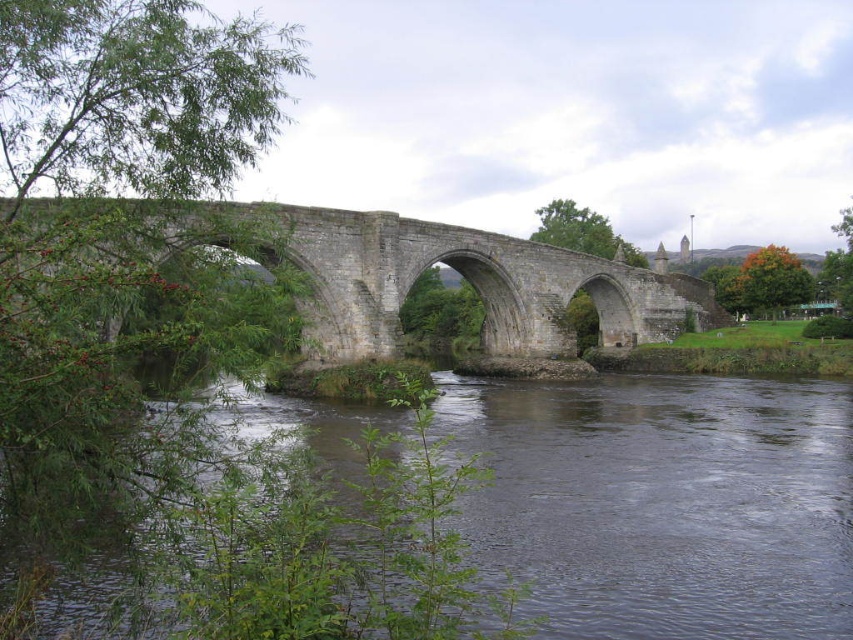
Consider the image. You are standing at the stone bridge and want to throw a pebble into the dark gray water at center. Considering the distance, will the pebble reach the water if you throw it with a maximum range of 150 feet?

The dark gray water at center is 175.76 feet away from the viewer. Since your maximum throw range is 150 feet, the pebble will not reach the water.

You are standing on the stone bridge at center and looking towards the dark gray water at center. Which object is closer to you?

The stone bridge at center is closer to you since you are standing on it, while the dark gray water at center is further away as it is positioned behind the bridge.